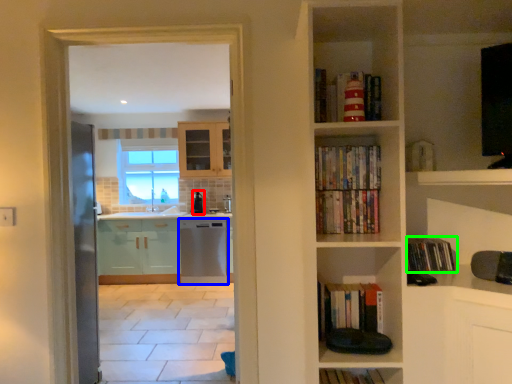
Question: Which object is positioned farthest from appliance (highlighted by a red box)? Select from dish washer (highlighted by a blue box) and book (highlighted by a green box).

Choices:
 (A) dish washer
 (B) book

Answer: (B)